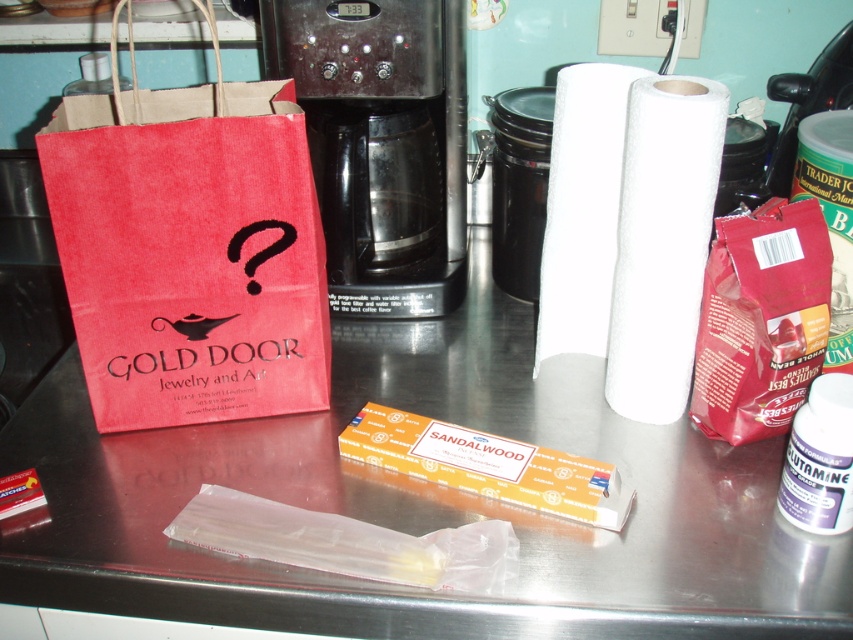
Question: Among these points, which one is farthest from the camera?

Choices:
 (A) pos(500,170)
 (B) pos(827,244)
 (C) pos(192,362)

Answer: (A)

Question: Considering the relative positions of white matte paper towel at center and black plastic container at center in the image provided, where is white matte paper towel at center located with respect to black plastic container at center?

Choices:
 (A) above
 (B) below

Answer: (B)

Question: In this image, where is matte paper bag at left located relative to red matte paper bag at right?

Choices:
 (A) above
 (B) below

Answer: (A)

Question: Which object appears farthest from the camera in this image?

Choices:
 (A) red matte paper bag at right
 (B) black plastic coffee machine at center
 (C) white matte paper towel at center
 (D) white paper towel at center

Answer: (B)

Question: Which of the following is the closest to the observer?

Choices:
 (A) black plastic coffee machine at center
 (B) red matte paper bag at right
 (C) black plastic container at center
 (D) white paper towel at center

Answer: (B)

Question: Is the position of black plastic coffee machine at center more distant than that of white paper towel at center?

Choices:
 (A) yes
 (B) no

Answer: (A)